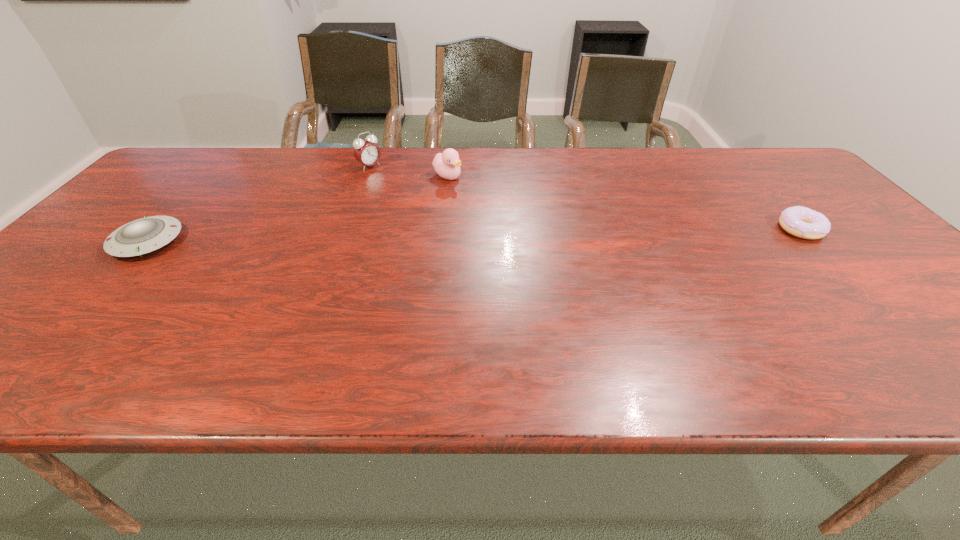
This screenshot has width=960, height=540. Find the location of `empty space between the doughnut and the alarm clock`. empty space between the doughnut and the alarm clock is located at coordinates (586, 198).

You are a GUI agent. You are given a task and a screenshot of the screen. Output one action in this format:
    pyautogui.click(x=<x>, y=<y>)
    Task: Click on the free space that is in between the third shortest object and the rightmost object
    This screenshot has width=960, height=540.
    Given the screenshot: What is the action you would take?
    pyautogui.click(x=624, y=202)

Find the location of a particular element. The height and width of the screenshot is (540, 960). vacant space that's between the rightmost object and the leftmost object is located at coordinates (474, 235).

Locate an element on the screen. The width and height of the screenshot is (960, 540). the closest object to the saucer is located at coordinates pyautogui.click(x=366, y=152).

Where is `object that is the third nearest to the third object from left to right`? This screenshot has height=540, width=960. object that is the third nearest to the third object from left to right is located at coordinates [799, 221].

You are a GUI agent. You are given a task and a screenshot of the screen. Output one action in this format:
    pyautogui.click(x=<x>, y=<y>)
    Task: Click on the blank area in the image that satisfies the following two spatial constraints: 1. on the front side of the duckling; 2. on the left side of the doughnut
    The width and height of the screenshot is (960, 540).
    Given the screenshot: What is the action you would take?
    pyautogui.click(x=442, y=229)

The image size is (960, 540). I want to click on free space that satisfies the following two spatial constraints: 1. on the front side of the second object from right to left; 2. on the right side of the third object from right to left, so click(x=366, y=177).